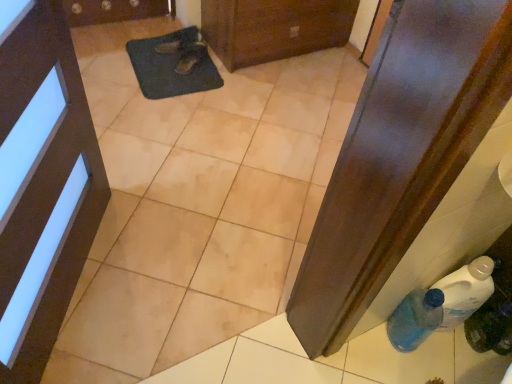
The width and height of the screenshot is (512, 384). I want to click on vacant area that is in front of black leather shoe at upper center, positioned as the second footwear in bottom-to-top order, so click(163, 65).